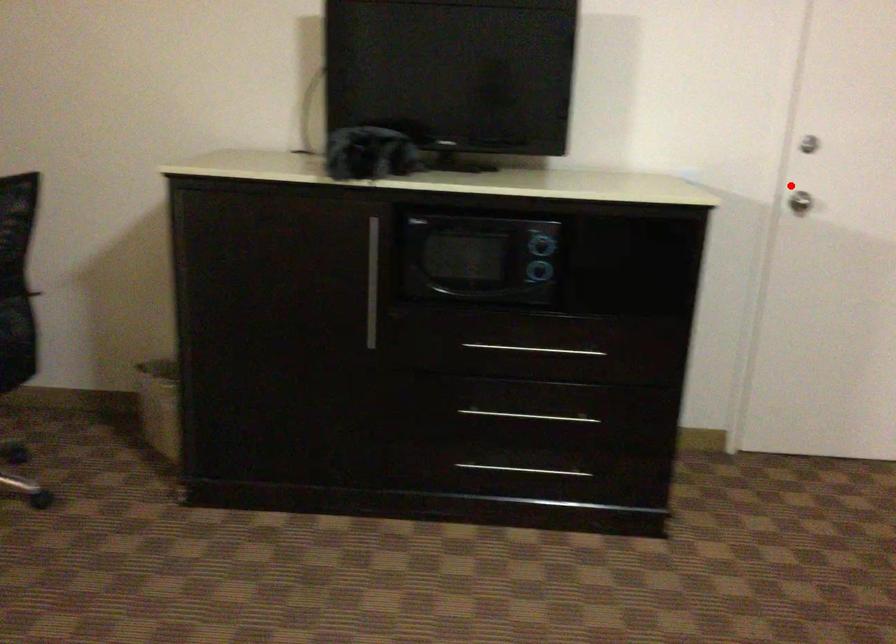
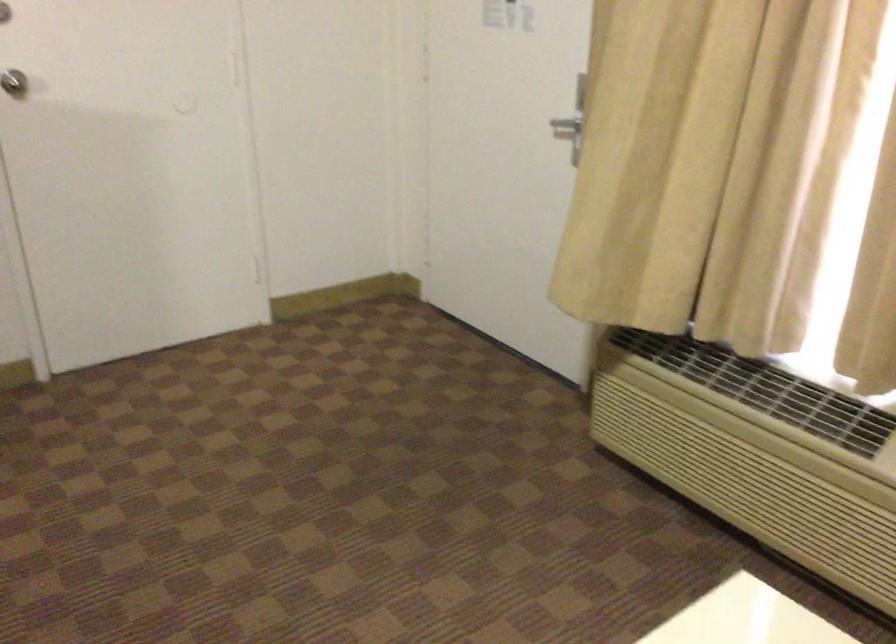
Question: I am providing you with two images of the same scene from different viewpoints. Image1 has a red point marked. In image2, the corresponding 3D location appears at what relative position? Reply with the corresponding letter.

Choices:
 (A) Closer
 (B) Farther

Answer: (A)